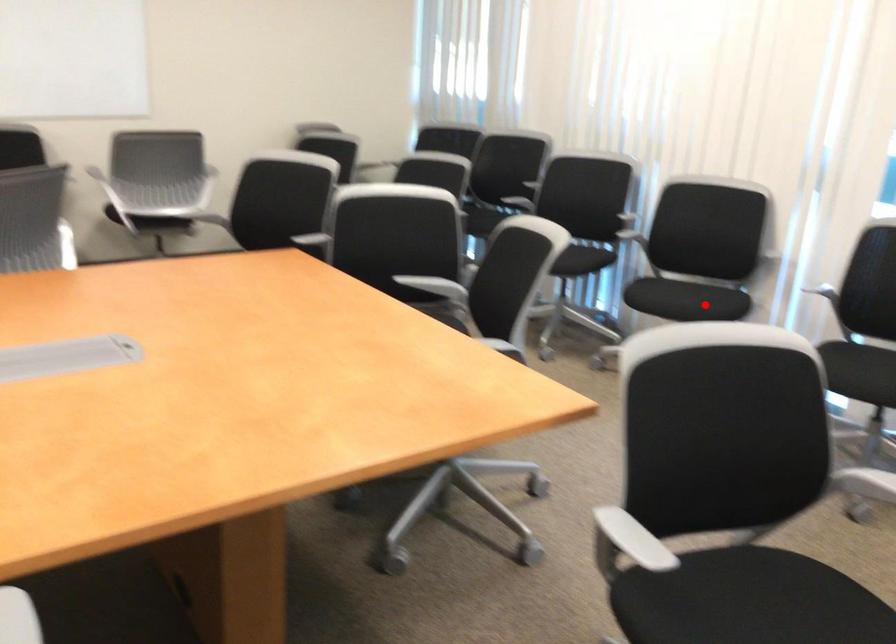
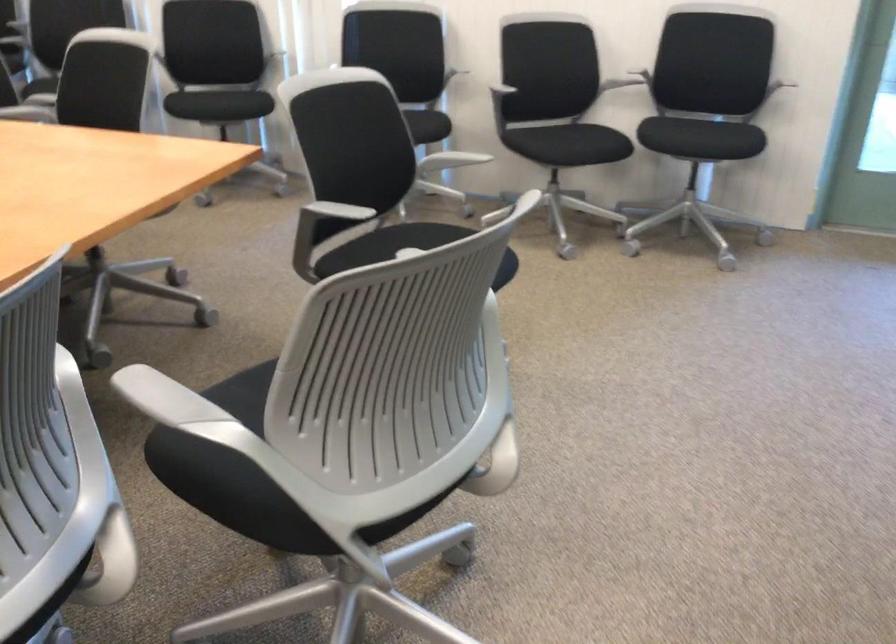
Question: I am providing you with two images of the same scene from different viewpoints. Image1 has a red point marked. In image2, the corresponding 3D location appears at what relative position? Reply with the corresponding letter.

Choices:
 (A) Closer
 (B) Farther

Answer: (B)